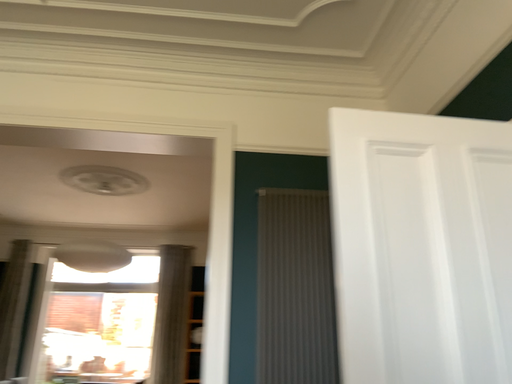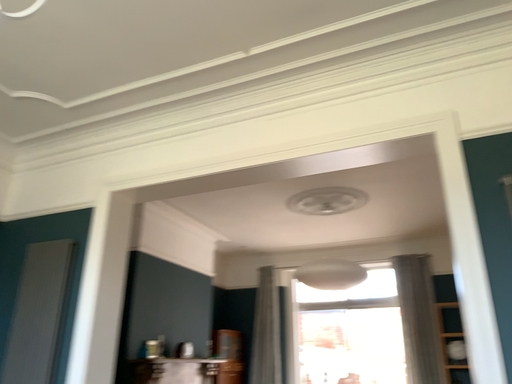
Question: How did the camera likely rotate when shooting the video?

Choices:
 (A) rotated right
 (B) rotated left

Answer: (B)